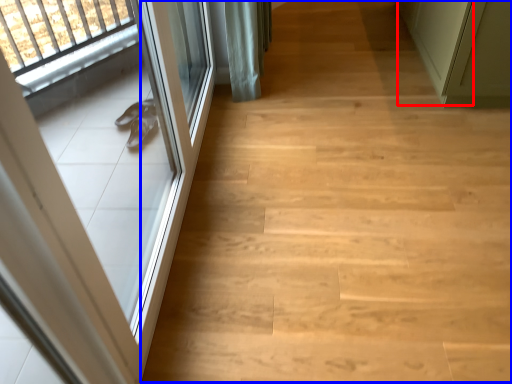
Question: Which point is further to the camera, door (highlighted by a red box) or stairwell (highlighted by a blue box)?

Choices:
 (A) door
 (B) stairwell

Answer: (A)